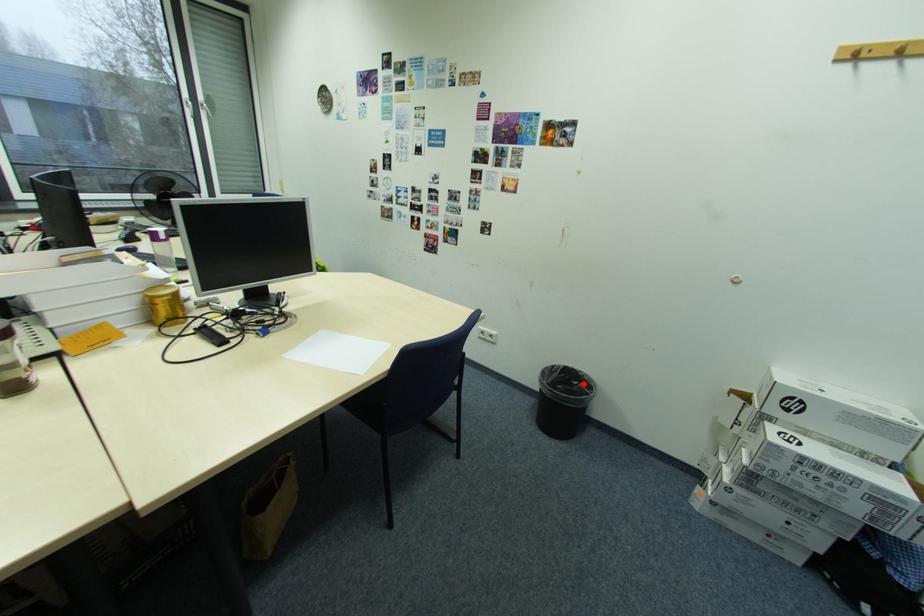
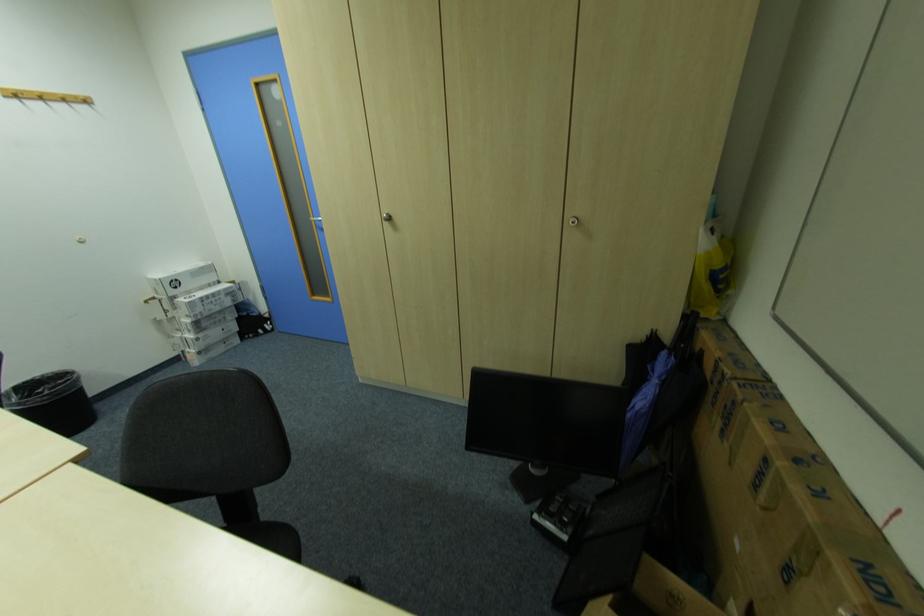
Locate, in the second image, the point that corresponds to the highlighted location in the first image.

(49, 391)